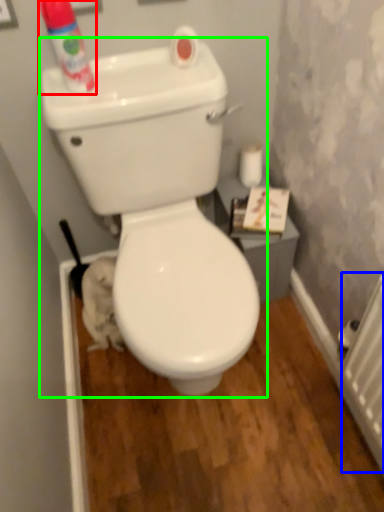
Question: Based on their relative distances, which object is farther from cleaning product (highlighted by a red box)? Choose from radiator (highlighted by a blue box) and toilet (highlighted by a green box).

Choices:
 (A) radiator
 (B) toilet

Answer: (A)